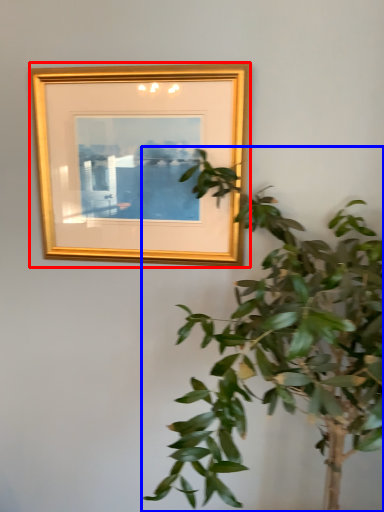
Question: Which of the following is the closest to the observer, picture frame (highlighted by a red box) or houseplant (highlighted by a blue box)?

Choices:
 (A) picture frame
 (B) houseplant

Answer: (B)